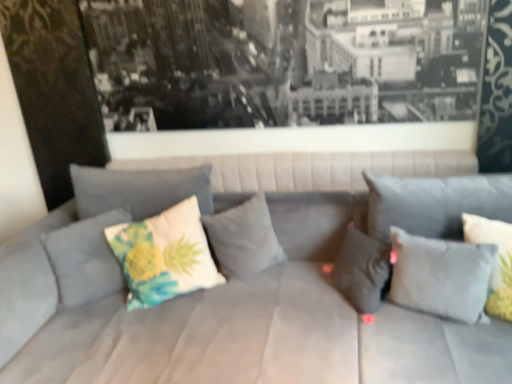
Question: Can you confirm if floral fabric pillow at center, marked as the 6th pillow in a right-to-left arrangement, is wider than white fabric pillow at right, the 6th pillow positioned from the left?

Choices:
 (A) no
 (B) yes

Answer: (B)

Question: Considering the relative sizes of floral fabric pillow at center, marked as the 6th pillow in a right-to-left arrangement, and white fabric pillow at right, the 6th pillow positioned from the left, in the image provided, is floral fabric pillow at center, marked as the 6th pillow in a right-to-left arrangement, smaller than white fabric pillow at right, the 6th pillow positioned from the left,?

Choices:
 (A) no
 (B) yes

Answer: (A)

Question: Is floral fabric pillow at center, which appears as the first pillow when viewed from the left, bigger than white fabric pillow at right, the 6th pillow positioned from the left?

Choices:
 (A) no
 (B) yes

Answer: (B)

Question: Is floral fabric pillow at center, marked as the 6th pillow in a right-to-left arrangement, at the left side of white fabric pillow at right, the 6th pillow positioned from the left?

Choices:
 (A) no
 (B) yes

Answer: (B)

Question: Is floral fabric pillow at center, which appears as the first pillow when viewed from the left, with white fabric pillow at right, the 6th pillow positioned from the left?

Choices:
 (A) yes
 (B) no

Answer: (B)

Question: Based on their sizes in the image, would you say suede gray couch at center is bigger or smaller than white matte pillow at right, which is counted as the 2th pillow, starting from the right?

Choices:
 (A) big
 (B) small

Answer: (A)

Question: Is suede gray couch at center in front of or behind white matte pillow at right, which is counted as the 2th pillow, starting from the right, in the image?

Choices:
 (A) behind
 (B) front

Answer: (B)

Question: From a real-world perspective, is suede gray couch at center physically located above or below white matte pillow at right, which is counted as the 2th pillow, starting from the right?

Choices:
 (A) above
 (B) below

Answer: (B)

Question: Is suede gray couch at center spatially inside white matte pillow at right, which is counted as the 2th pillow, starting from the right, or outside of it?

Choices:
 (A) outside
 (B) inside

Answer: (A)

Question: From their relative heights in the image, would you say gray fabric pillow at center, positioned as the fourth pillow in right-to-left order, is taller or shorter than gray fabric pillow at center, marked as the 3th pillow in a right-to-left arrangement?

Choices:
 (A) tall
 (B) short

Answer: (A)

Question: Would you say gray fabric pillow at center, positioned as the fourth pillow in right-to-left order, is to the left or to the right of gray fabric pillow at center, marked as the fourth pillow in a left-to-right arrangement, in the picture?

Choices:
 (A) right
 (B) left

Answer: (B)

Question: From the image's perspective, relative to gray fabric pillow at center, marked as the 3th pillow in a right-to-left arrangement, is gray fabric pillow at center, which is the 3th pillow from left to right, above or below?

Choices:
 (A) above
 (B) below

Answer: (A)

Question: Do you think gray fabric pillow at center, positioned as the fourth pillow in right-to-left order, is within gray fabric pillow at center, marked as the fourth pillow in a left-to-right arrangement, or outside of it?

Choices:
 (A) outside
 (B) inside

Answer: (A)

Question: In terms of width, does suede gray couch at center look wider or thinner when compared to gray fabric pillow at center, positioned as the fourth pillow in right-to-left order?

Choices:
 (A) thin
 (B) wide

Answer: (B)

Question: From a real-world perspective, is suede gray couch at center positioned above or below gray fabric pillow at center, positioned as the fourth pillow in right-to-left order?

Choices:
 (A) below
 (B) above

Answer: (A)